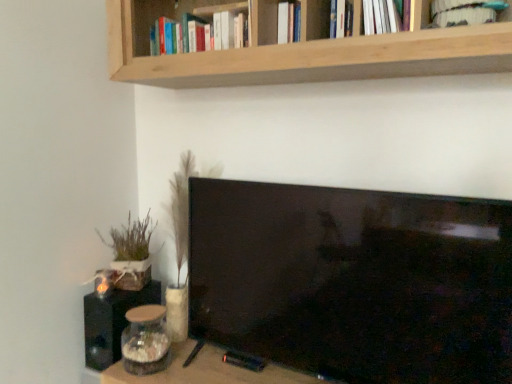
Question: Considering the relative positions of wooden table at lower center and white fabric book at upper right, which is the second book in left-to-right order, in the image provided, is wooden table at lower center to the right of white fabric book at upper right, which is the second book in left-to-right order, from the viewer's perspective?

Choices:
 (A) yes
 (B) no

Answer: (B)

Question: Is wooden table at lower center oriented towards white fabric book at upper right, the 1th book from the right?

Choices:
 (A) no
 (B) yes

Answer: (A)

Question: Does wooden table at lower center appear on the left side of white fabric book at upper right, which is the second book in left-to-right order?

Choices:
 (A) no
 (B) yes

Answer: (B)

Question: Considering the relative sizes of wooden table at lower center and white fabric book at upper right, the 1th book from the right, in the image provided, is wooden table at lower center thinner than white fabric book at upper right, the 1th book from the right,?

Choices:
 (A) yes
 (B) no

Answer: (B)

Question: Considering the relative sizes of wooden table at lower center and white fabric book at upper right, placed as the second book when sorted from back to front, in the image provided, is wooden table at lower center bigger than white fabric book at upper right, placed as the second book when sorted from back to front,?

Choices:
 (A) no
 (B) yes

Answer: (B)

Question: From the image's perspective, is white fabric book at upper right, marked as the first book in a front-to-back arrangement, located above or below black matte speaker at lower left?

Choices:
 (A) below
 (B) above

Answer: (B)

Question: Relative to black matte speaker at lower left, is white fabric book at upper right, which is the second book in left-to-right order, in front or behind?

Choices:
 (A) front
 (B) behind

Answer: (A)

Question: Is white fabric book at upper right, the 1th book from the right, bigger or smaller than black matte speaker at lower left?

Choices:
 (A) small
 (B) big

Answer: (A)

Question: Considering the positions of white fabric book at upper right, the 1th book from the right, and black matte speaker at lower left in the image, is white fabric book at upper right, the 1th book from the right, taller or shorter than black matte speaker at lower left?

Choices:
 (A) tall
 (B) short

Answer: (B)

Question: From the image's perspective, is natural wood shelf at upper center located above or below black matte speaker at lower left?

Choices:
 (A) above
 (B) below

Answer: (A)

Question: In terms of height, does natural wood shelf at upper center look taller or shorter compared to black matte speaker at lower left?

Choices:
 (A) short
 (B) tall

Answer: (B)

Question: From a real-world perspective, relative to black matte speaker at lower left, is natural wood shelf at upper center vertically above or below?

Choices:
 (A) above
 (B) below

Answer: (A)

Question: Looking at the image, does natural wood shelf at upper center seem bigger or smaller compared to black matte speaker at lower left?

Choices:
 (A) big
 (B) small

Answer: (A)

Question: Visually, is white fabric book at upper right, marked as the first book in a front-to-back arrangement, positioned to the left or to the right of hardcover books at upper center, the first book positioned from the left?

Choices:
 (A) right
 (B) left

Answer: (A)

Question: Relative to hardcover books at upper center, the 1th book when ordered from back to front, is white fabric book at upper right, marked as the first book in a front-to-back arrangement, in front or behind?

Choices:
 (A) front
 (B) behind

Answer: (A)